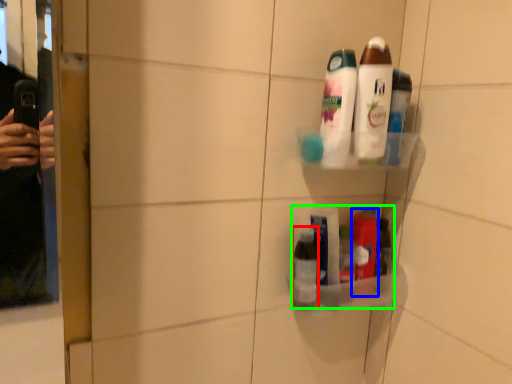
Question: Estimate the real-world distances between objects in this image. Which object is closer to toiletry (highlighted by a red box), toiletry (highlighted by a blue box) or product (highlighted by a green box)?

Choices:
 (A) toiletry
 (B) product

Answer: (B)